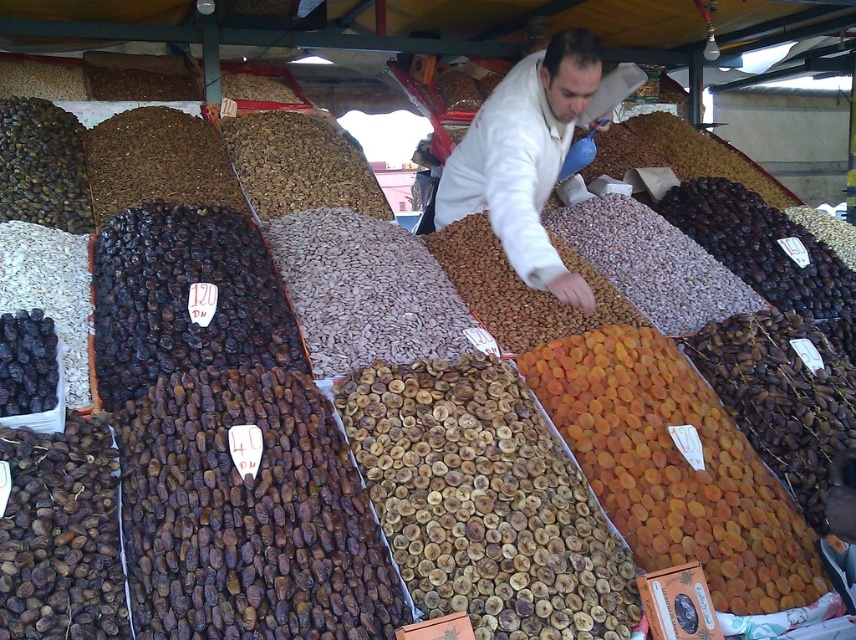
Can you confirm if orange dried apricot at center is positioned to the right of white matte jacket at center?

Correct, you'll find orange dried apricot at center to the right of white matte jacket at center.

What do you see at coordinates (675, 467) in the screenshot?
I see `orange dried apricot at center` at bounding box center [675, 467].

You are a GUI agent. You are given a task and a screenshot of the screen. Output one action in this format:
    pyautogui.click(x=<x>, y=<y>)
    Task: Click on the orange dried apricot at center
    
    Given the screenshot: What is the action you would take?
    pyautogui.click(x=675, y=467)